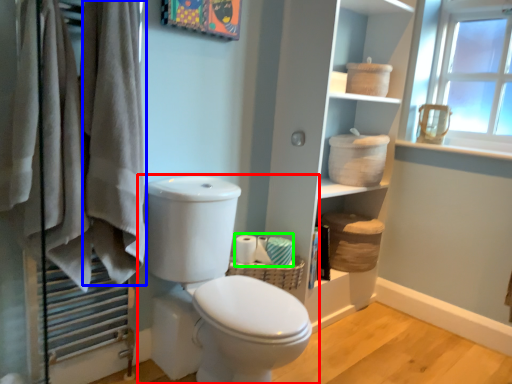
Question: Based on their relative distances, which object is nearer to toilet (highlighted by a red box)? Choose from bath towel (highlighted by a blue box) and toilet paper (highlighted by a green box).

Choices:
 (A) bath towel
 (B) toilet paper

Answer: (A)